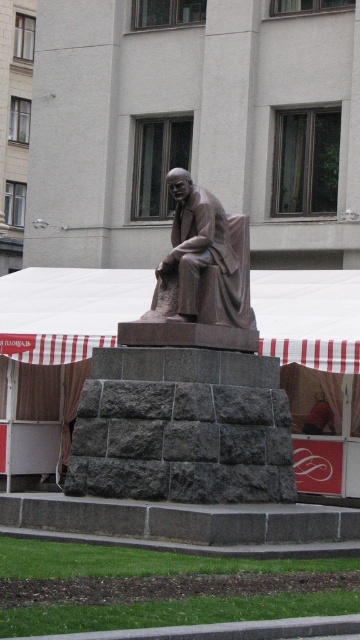
You are a visitor approaching the bronze statue at center and the white striped canopy at center. Based on the scene, which object is closer to you as you walk towards them?

The bronze statue at center is closer to you because it is positioned in front of the white striped canopy at center.